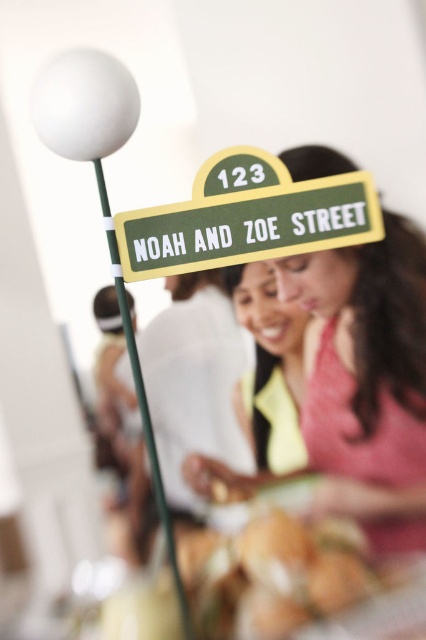
Question: Among these objects, which one is farthest from the camera?

Choices:
 (A) green matte street sign at upper center
 (B) green matte street sign at center

Answer: (A)

Question: Is green matte street sign at upper center above green matte street sign at center?

Choices:
 (A) no
 (B) yes

Answer: (A)

Question: Is green matte street sign at upper center closer to camera compared to green matte street sign at center?

Choices:
 (A) no
 (B) yes

Answer: (A)

Question: Does green matte street sign at upper center appear over green matte street sign at center?

Choices:
 (A) yes
 (B) no

Answer: (B)